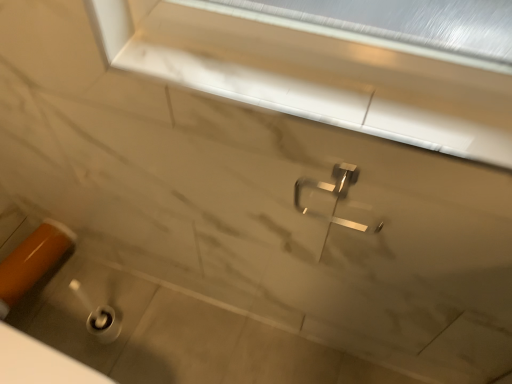
Question: Is orange glossy door handle at lower left far away from polished metallic tap at center?

Choices:
 (A) yes
 (B) no

Answer: (B)

Question: From the image's perspective, is orange glossy door handle at lower left below polished metallic tap at center?

Choices:
 (A) yes
 (B) no

Answer: (A)

Question: Does orange glossy door handle at lower left have a lesser height compared to polished metallic tap at center?

Choices:
 (A) yes
 (B) no

Answer: (A)

Question: Is orange glossy door handle at lower left facing towards polished metallic tap at center?

Choices:
 (A) yes
 (B) no

Answer: (B)

Question: Is orange glossy door handle at lower left at the left side of polished metallic tap at center?

Choices:
 (A) no
 (B) yes

Answer: (B)

Question: Is orange glossy door handle at lower left positioned beyond the bounds of polished metallic tap at center?

Choices:
 (A) no
 (B) yes

Answer: (B)

Question: Is orange glossy door handle at lower left at the left side of white marble window frame at upper center?

Choices:
 (A) no
 (B) yes

Answer: (B)

Question: Can you see orange glossy door handle at lower left touching white marble window frame at upper center?

Choices:
 (A) yes
 (B) no

Answer: (B)

Question: From the image's perspective, would you say orange glossy door handle at lower left is positioned over white marble window frame at upper center?

Choices:
 (A) yes
 (B) no

Answer: (B)

Question: Does orange glossy door handle at lower left have a lesser width compared to white marble window frame at upper center?

Choices:
 (A) no
 (B) yes

Answer: (B)

Question: Does orange glossy door handle at lower left come in front of white marble window frame at upper center?

Choices:
 (A) yes
 (B) no

Answer: (B)

Question: Is orange glossy door handle at lower left surrounding white marble window frame at upper center?

Choices:
 (A) no
 (B) yes

Answer: (A)

Question: Can you confirm if white marble window frame at upper center is positioned to the right of polished metallic tap at center?

Choices:
 (A) yes
 (B) no

Answer: (B)